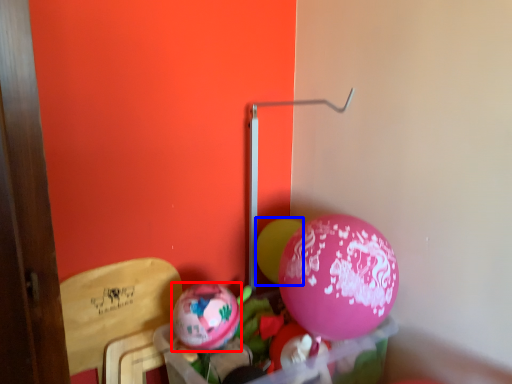
Question: Among these objects, which one is nearest to the camera, balloon (highlighted by a red box) or balloon (highlighted by a blue box)?

Choices:
 (A) balloon
 (B) balloon

Answer: (A)